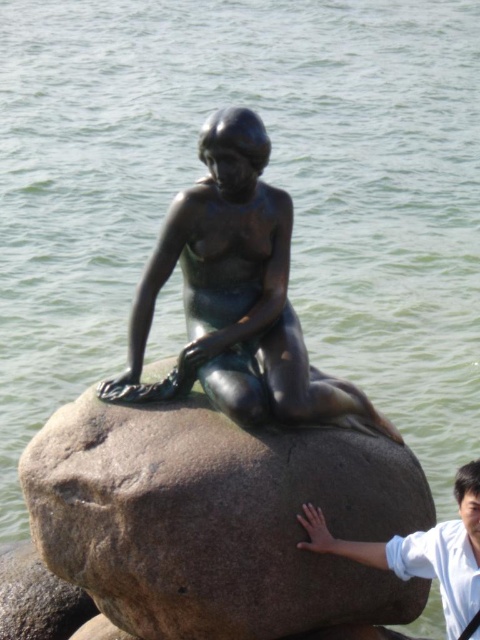
Is point (255, 397) less distant than point (467, 468)?

That is True.

Does bronze statue at center appear on the left side of white shirt at center?

Yes, bronze statue at center is to the left of white shirt at center.

Which is behind, point (167, 268) or point (432, 556)?

Point (167, 268)

Where is `bronze statue at center`? bronze statue at center is located at coordinates (237, 296).

Who is positioned more to the left, granite rock at center or gray granite rock at center?

Positioned to the left is gray granite rock at center.

Does point (160, 433) come in front of point (54, 632)?

Yes, it is in front of point (54, 632).

Which is in front, point (298, 584) or point (6, 624)?

Point (298, 584)

You are a GUI agent. You are given a task and a screenshot of the screen. Output one action in this format:
    pyautogui.click(x=<x>, y=<y>)
    Task: Click on the granite rock at center
    Image resolution: width=480 pixels, height=640 pixels.
    Given the screenshot: What is the action you would take?
    pyautogui.click(x=217, y=518)

Does granite rock at center appear on the left side of bronze statue at center?

No, granite rock at center is not to the left of bronze statue at center.

Is point (113, 492) in front of point (204, 320)?

That is True.

This screenshot has width=480, height=640. Find the location of `granite rock at center`. granite rock at center is located at coordinates (217, 518).